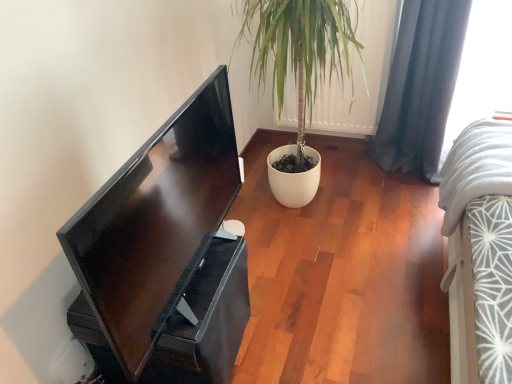
What are the coordinates of `free space in front of dark blue fabric curtain at right` in the screenshot? It's located at (403, 196).